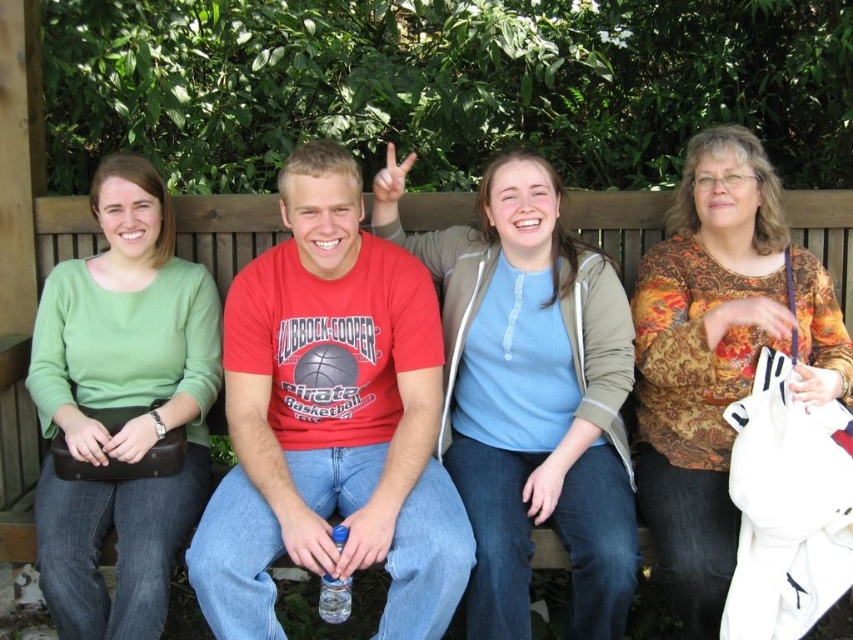
Is red cotton t-shirt at center behind light blue sweater at center?

No, it is in front of light blue sweater at center.

Measure the distance between point (254, 419) and camera.

8.67 feet

Find the location of a particular element. The height and width of the screenshot is (640, 853). red cotton t-shirt at center is located at coordinates (331, 419).

Which is more to the right, light blue sweater at center or floral-patterned blouse at right?

floral-patterned blouse at right

Does point (548, 424) come in front of point (692, 218)?

Yes, it is in front of point (692, 218).

Where is `light blue sweater at center`? The height and width of the screenshot is (640, 853). light blue sweater at center is located at coordinates (531, 394).

Who is lower down, green matte sweater at left or floral-patterned blouse at right?

green matte sweater at left is lower down.

What do you see at coordinates (122, 406) in the screenshot? Image resolution: width=853 pixels, height=640 pixels. I see `green matte sweater at left` at bounding box center [122, 406].

What do you see at coordinates (122, 406) in the screenshot? I see `green matte sweater at left` at bounding box center [122, 406].

This screenshot has width=853, height=640. In order to click on green matte sweater at left in this screenshot , I will do `click(122, 406)`.